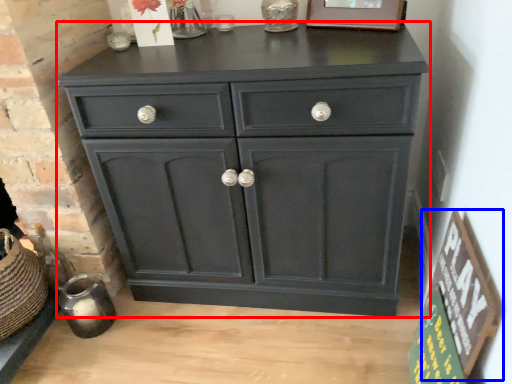
Question: Which object appears closest to the camera in this image, chest of drawers (highlighted by a red box) or bulletin board (highlighted by a blue box)?

Choices:
 (A) chest of drawers
 (B) bulletin board

Answer: (B)